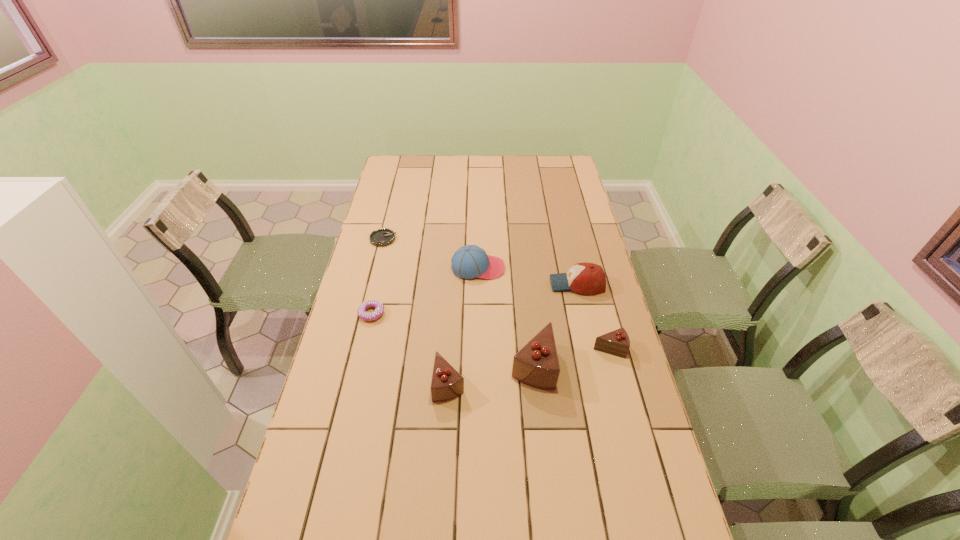
Find the location of a particular element. This screenshot has height=540, width=960. the second shortest chocolate cake is located at coordinates (447, 383).

The width and height of the screenshot is (960, 540). Identify the location of the tallest object. (536, 364).

Locate an element on the screen. The width and height of the screenshot is (960, 540). the tallest chocolate cake is located at coordinates (536, 364).

Find the location of a particular element. This screenshot has width=960, height=540. the rightmost chocolate cake is located at coordinates (617, 342).

The height and width of the screenshot is (540, 960). I want to click on the third shortest object, so click(x=617, y=342).

Where is `doughnut`? doughnut is located at coordinates (379, 307).

What are the coordinates of `the second shortest object` in the screenshot? It's located at (379, 307).

At what (x,y) coordinates should I click in order to perform the action: click on the left baseball cap. Please return your answer as a coordinate pair (x, y). Looking at the image, I should click on (x=470, y=261).

The height and width of the screenshot is (540, 960). In order to click on the right baseball cap in this screenshot , I will do `click(585, 278)`.

Locate an element on the screen. the farthest object is located at coordinates (382, 237).